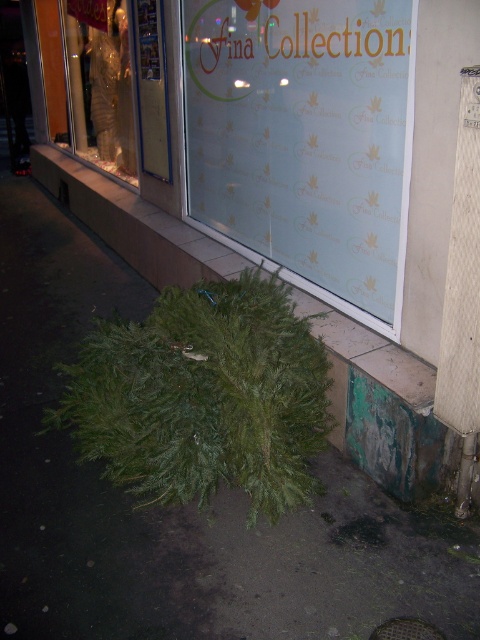
Between green leafy wreath at lower center and frosted glass window at center, which one has less height?

green leafy wreath at lower center is shorter.

Who is positioned more to the left, green leafy wreath at lower center or frosted glass window at center?

Positioned to the left is green leafy wreath at lower center.

Does point (55, 317) come behind point (184, 26)?

Yes, point (55, 317) is farther from viewer.

Where is `green leafy wreath at lower center`? This screenshot has width=480, height=640. green leafy wreath at lower center is located at coordinates [x=180, y=506].

Consider the image. Between frosted glass window at center and gold metallic mannequin at upper left, which one appears on the left side from the viewer's perspective?

gold metallic mannequin at upper left

Is frosted glass window at center to the right of gold metallic mannequin at upper left from the viewer's perspective?

Yes, frosted glass window at center is to the right of gold metallic mannequin at upper left.

What do you see at coordinates (305, 140) in the screenshot?
I see `frosted glass window at center` at bounding box center [305, 140].

Find the location of a particular element. frosted glass window at center is located at coordinates (305, 140).

Can you confirm if green natural tree at lower center is thinner than green leafy plant at lower left?

Yes, green natural tree at lower center is thinner than green leafy plant at lower left.

Image resolution: width=480 pixels, height=640 pixels. What are the coordinates of `green natural tree at lower center` in the screenshot? It's located at (204, 396).